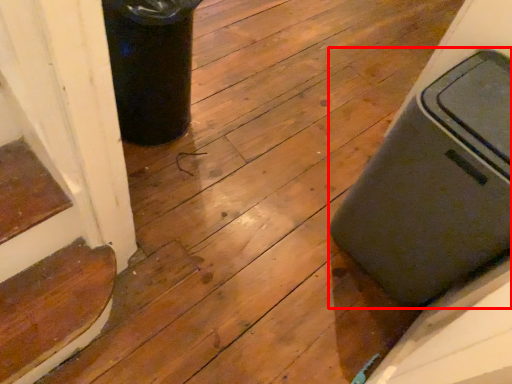
Question: From the image's perspective, considering the relative positions of waste container (annotated by the red box) and stairwell in the image provided, where is waste container (annotated by the red box) located with respect to the staircase?

Choices:
 (A) below
 (B) above

Answer: (B)